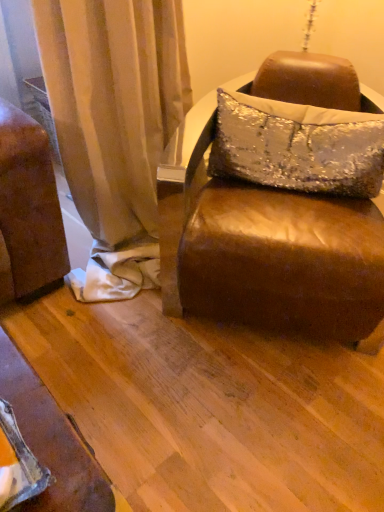
Question: Does silver sequined pillow at center have a lesser width compared to brown leather ottoman at center?

Choices:
 (A) yes
 (B) no

Answer: (A)

Question: Considering the relative positions of silver sequined pillow at center and brown leather ottoman at center in the image provided, is silver sequined pillow at center behind brown leather ottoman at center?

Choices:
 (A) yes
 (B) no

Answer: (A)

Question: Is silver sequined pillow at center far from brown leather ottoman at center?

Choices:
 (A) yes
 (B) no

Answer: (B)

Question: From the image's perspective, is silver sequined pillow at center located beneath brown leather ottoman at center?

Choices:
 (A) yes
 (B) no

Answer: (B)

Question: Is brown leather ottoman at center completely or partially inside silver sequined pillow at center?

Choices:
 (A) yes
 (B) no

Answer: (B)

Question: Is silver sequined pillow at center shorter than brown leather ottoman at center?

Choices:
 (A) yes
 (B) no

Answer: (A)

Question: Is brown leather ottoman at center closer to the viewer compared to silver sequined pillow at center?

Choices:
 (A) yes
 (B) no

Answer: (A)

Question: Does brown leather ottoman at center appear on the left side of silver sequined pillow at center?

Choices:
 (A) no
 (B) yes

Answer: (B)

Question: Would you say brown leather ottoman at center is a long distance from silver sequined pillow at center?

Choices:
 (A) no
 (B) yes

Answer: (A)

Question: From the image's perspective, is brown leather ottoman at center beneath silver sequined pillow at center?

Choices:
 (A) yes
 (B) no

Answer: (A)

Question: Can you confirm if brown leather ottoman at center is shorter than silver sequined pillow at center?

Choices:
 (A) yes
 (B) no

Answer: (B)

Question: Is brown leather ottoman at center positioned beyond the bounds of silver sequined pillow at center?

Choices:
 (A) yes
 (B) no

Answer: (A)

Question: Is point tap(362, 115) positioned closer to the camera than point tap(195, 301)?

Choices:
 (A) closer
 (B) farther

Answer: (B)